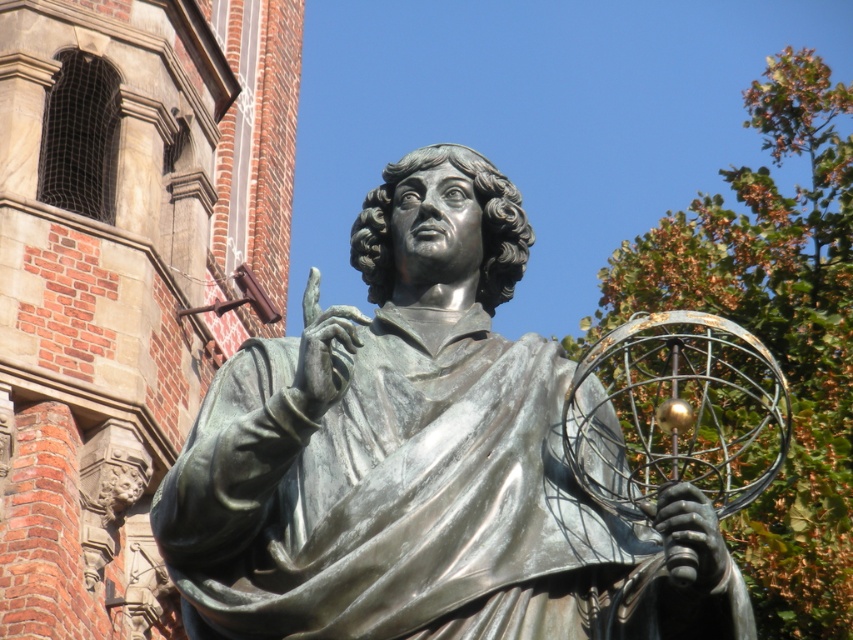
Who is more forward, [236,486] or [9,145]?

Point [236,486]

Between bronze statue at center and brick wall at center, which one is positioned lower?

Positioned lower is bronze statue at center.

Between point (462, 403) and point (33, 320), which one is positioned behind?

The point (33, 320) is behind.

Find the location of a particular element. bronze statue at center is located at coordinates (421, 458).